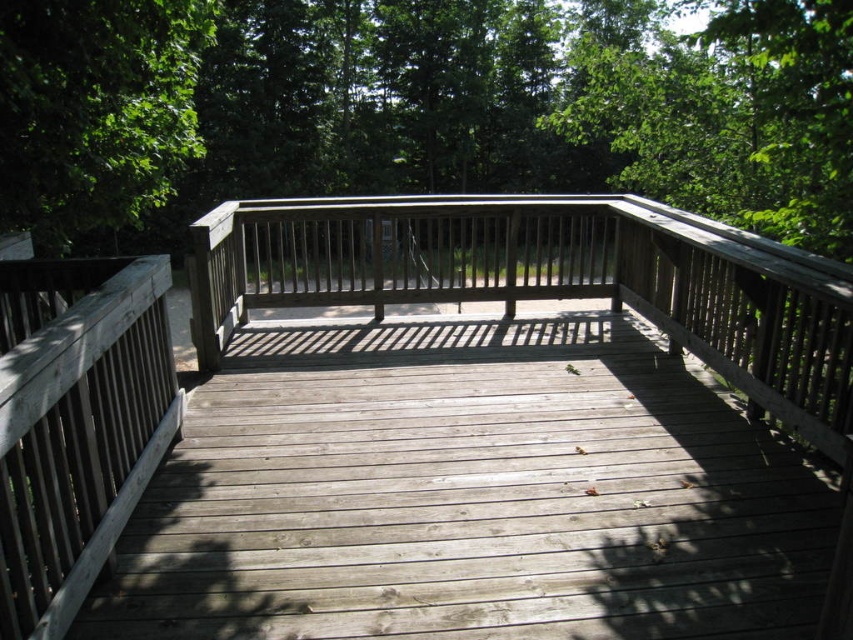
You are sitting on the weathered wood bench at center and want to see the view beyond the green matte fence at upper center. Can you see it from your current position?

The green matte fence at upper center is positioned over the weathered wood bench at center, so you cannot see beyond the fence from your current position.

You are standing on the wooden deck surrounded by greenery and want to sit down. Where exactly should you go to find the weathered wood bench at center?

The weathered wood bench at center is located at the coordinates point [548,280].

In the scene shown: You are standing on the wooden deck and want to know which object is higher up in the scene. Can you tell me whether the green matte fence at upper center or the green leafy tree at upper left is positioned higher?

The green matte fence at upper center is located above the green leafy tree at upper left, so the green matte fence at upper center is positioned higher.